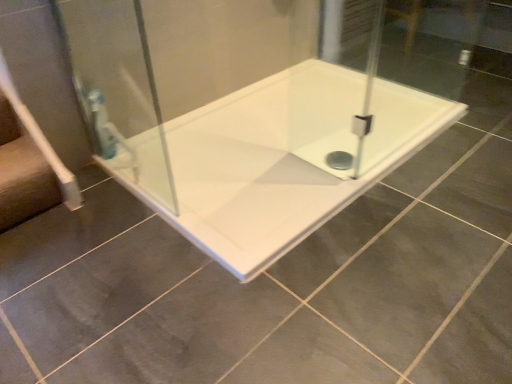
Find the location of a particular element. unoccupied area in front of white glossy bathtub at center is located at coordinates (307, 292).